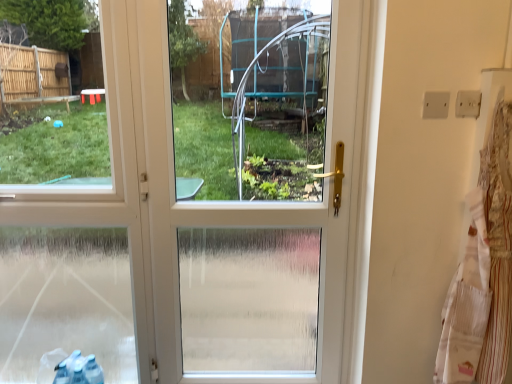
Question: Is white plastic screen door at center at the right side of white striped laundry at right?

Choices:
 (A) no
 (B) yes

Answer: (A)

Question: Can you confirm if white plastic screen door at center is smaller than white striped laundry at right?

Choices:
 (A) yes
 (B) no

Answer: (B)

Question: From the image's perspective, is white plastic screen door at center located beneath white striped laundry at right?

Choices:
 (A) yes
 (B) no

Answer: (B)

Question: Considering the relative sizes of white plastic screen door at center and white striped laundry at right in the image provided, is white plastic screen door at center wider than white striped laundry at right?

Choices:
 (A) yes
 (B) no

Answer: (A)

Question: From the image's perspective, does white plastic screen door at center appear higher than white striped laundry at right?

Choices:
 (A) no
 (B) yes

Answer: (B)

Question: Considering the relative sizes of white plastic screen door at center and white striped laundry at right in the image provided, is white plastic screen door at center taller than white striped laundry at right?

Choices:
 (A) no
 (B) yes

Answer: (B)

Question: From the image's perspective, is white striped laundry at right located beneath white plastic screen door at center?

Choices:
 (A) yes
 (B) no

Answer: (A)

Question: Is white striped laundry at right further to camera compared to white plastic screen door at center?

Choices:
 (A) no
 (B) yes

Answer: (A)

Question: Is white striped laundry at right bigger than white plastic screen door at center?

Choices:
 (A) no
 (B) yes

Answer: (A)

Question: Is white striped laundry at right taller than white plastic screen door at center?

Choices:
 (A) yes
 (B) no

Answer: (B)

Question: From a real-world perspective, is white striped laundry at right below white plastic screen door at center?

Choices:
 (A) yes
 (B) no

Answer: (A)

Question: Is white striped laundry at right smaller than white plastic screen door at center?

Choices:
 (A) yes
 (B) no

Answer: (A)

Question: From a real-world perspective, is white plastic screen door at center positioned above or below white striped laundry at right?

Choices:
 (A) below
 (B) above

Answer: (B)